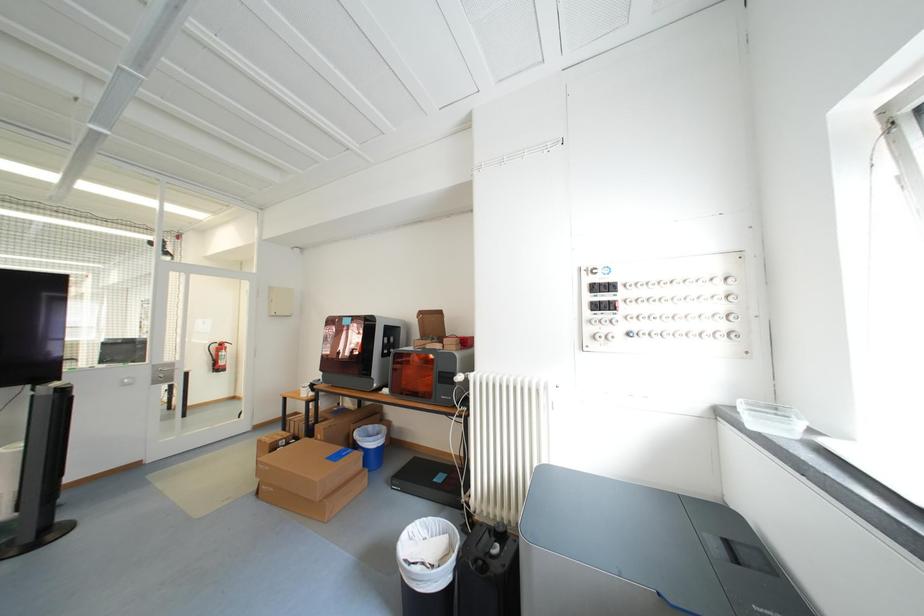
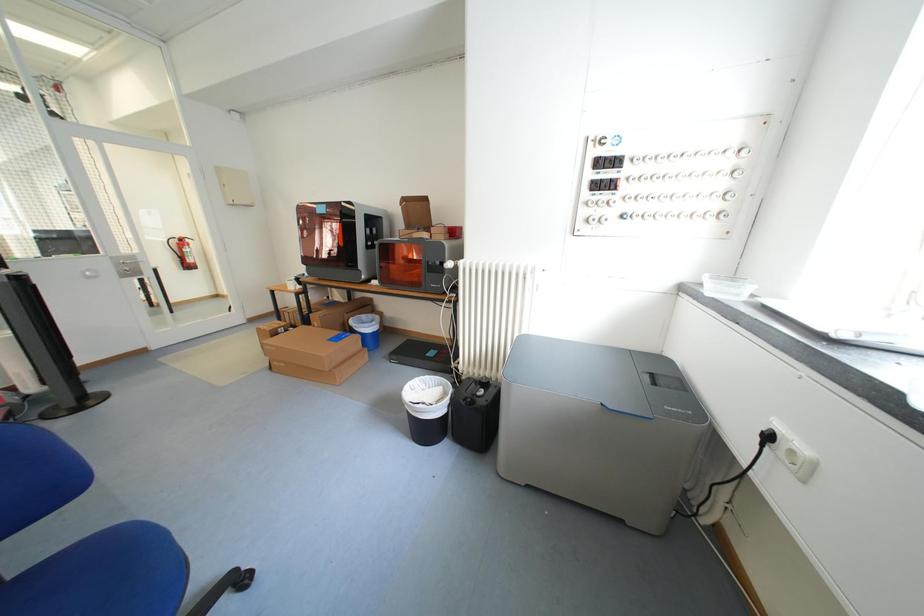
Question: What movement of the cameraman would produce the second image?

Choices:
 (A) Left
 (B) Right
 (C) Forward
 (D) Backward

Answer: (A)